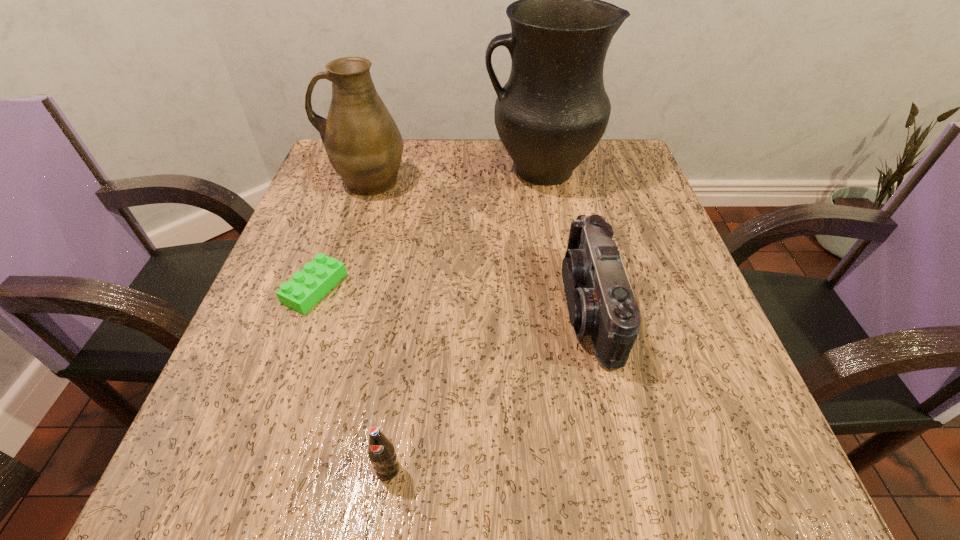
This screenshot has width=960, height=540. Find the location of `blank space located on the handle side of the taller pitcher`. blank space located on the handle side of the taller pitcher is located at coordinates (351, 170).

At what (x,y) coordinates should I click in order to perform the action: click on vacant space situated 0.290m on the front-facing side of the camcorder. Please return your answer as a coordinate pair (x, y). Image resolution: width=960 pixels, height=540 pixels. Looking at the image, I should click on (390, 308).

The height and width of the screenshot is (540, 960). Identify the location of vacant region located on the front-facing side of the camcorder. (509, 308).

What are the coordinates of `vacant space located on the front-facing side of the camcorder` in the screenshot? It's located at (383, 308).

I want to click on vacant space located 0.250m on the front of the Lego, so click(x=251, y=470).

Locate an element on the screen. The width and height of the screenshot is (960, 540). object that is at the near edge is located at coordinates (381, 452).

What are the coordinates of `pitcher at the left edge` in the screenshot? It's located at (363, 143).

Where is `Lego that is at the left edge`? The image size is (960, 540). Lego that is at the left edge is located at coordinates (307, 287).

Identify the location of pitcher positioned at the right edge. This screenshot has height=540, width=960. (552, 112).

I want to click on camcorder located at the right edge, so click(601, 303).